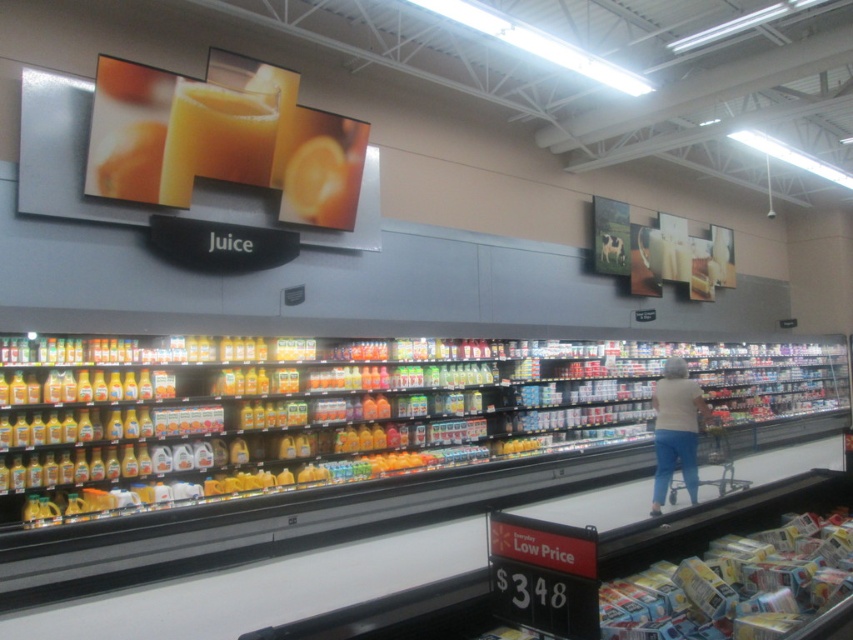
You are a customer in the grocery store and want to grab both the smooth orange juice at upper center and the white cotton shirt at center. However, you can only reach one at a time. Which item should you reach for first to avoid knocking over the other?

You should reach for the smooth orange juice at upper center first because it is positioned over the white cotton shirt at center. By taking the upper item first, you avoid disturbing the lower one below it.

You are a customer in the grocery store looking at the juice section. You see the smooth orange juice at upper center and the white cotton shirt at center. Which item is located to the left of the other?

The smooth orange juice at upper center is positioned on the left side of white cotton shirt at center.

You are a store employee who needs to place a new sign above the white cotton shirt at center. The sign requires a space that is taller than the object it is placed above. Can the sign be placed above the smooth orange juice at upper center without exceeding its height?

The smooth orange juice at upper center has a lesser height compared to the white cotton shirt at center. Since the sign needs to be taller than the object it is placed above, placing it above the smooth orange juice at upper center would not meet the requirement because the juice is shorter than the shirt. Therefore, the sign cannot be placed there.